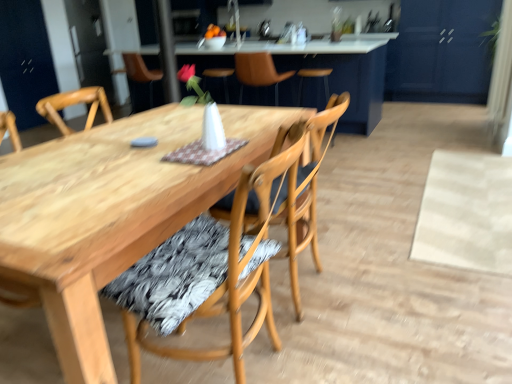
Question: From a real-world perspective, is wooden chair at center, the 2th chair from the front, positioned over leather at center, which is the 3th chair in front-to-back order, based on gravity?

Choices:
 (A) yes
 (B) no

Answer: (B)

Question: Can you confirm if wooden chair at center, placed as the 2th chair when sorted from back to front, is bigger than leather at center, which is the 3th chair in front-to-back order?

Choices:
 (A) yes
 (B) no

Answer: (A)

Question: From a real-world perspective, is wooden chair at center, placed as the 2th chair when sorted from back to front, physically below leather at center, acting as the first chair starting from the back?

Choices:
 (A) no
 (B) yes

Answer: (B)

Question: Is wooden chair at center, the 2th chair from the front, oriented away from leather at center, which is the 3th chair in front-to-back order?

Choices:
 (A) yes
 (B) no

Answer: (B)

Question: Can you confirm if wooden chair at center, placed as the 2th chair when sorted from back to front, is wider than leather at center, which is the 3th chair in front-to-back order?

Choices:
 (A) yes
 (B) no

Answer: (B)

Question: Looking at the image, does wooden table at center seem bigger or smaller compared to wooden chair at center, positioned as the 3th chair in back-to-front order?

Choices:
 (A) small
 (B) big

Answer: (B)

Question: Relative to wooden chair at center, which is the first chair in front-to-back order, is wooden table at center in front or behind?

Choices:
 (A) front
 (B) behind

Answer: (B)

Question: From their relative heights in the image, would you say wooden table at center is taller or shorter than wooden chair at center, positioned as the 3th chair in back-to-front order?

Choices:
 (A) tall
 (B) short

Answer: (B)

Question: From a real-world perspective, is wooden table at center positioned above or below wooden chair at center, which is the first chair in front-to-back order?

Choices:
 (A) above
 (B) below

Answer: (A)

Question: From a real-world perspective, is wooden chair at center, placed as the 2th chair when sorted from back to front, positioned above or below blue matte cabinet at upper right?

Choices:
 (A) below
 (B) above

Answer: (A)

Question: From the image's perspective, is wooden chair at center, the 2th chair from the front, above or below blue matte cabinet at upper right?

Choices:
 (A) below
 (B) above

Answer: (A)

Question: Is wooden chair at center, the 2th chair from the front, taller or shorter than blue matte cabinet at upper right?

Choices:
 (A) short
 (B) tall

Answer: (A)

Question: Considering the positions of wooden chair at center, placed as the 2th chair when sorted from back to front, and blue matte cabinet at upper right in the image, is wooden chair at center, placed as the 2th chair when sorted from back to front, bigger or smaller than blue matte cabinet at upper right?

Choices:
 (A) big
 (B) small

Answer: (B)

Question: From their relative heights in the image, would you say leather at center, acting as the first chair starting from the back, is taller or shorter than blue matte cabinet at upper right?

Choices:
 (A) tall
 (B) short

Answer: (B)

Question: Do you think leather at center, which is the 3th chair in front-to-back order, is within blue matte cabinet at upper right, or outside of it?

Choices:
 (A) outside
 (B) inside

Answer: (A)